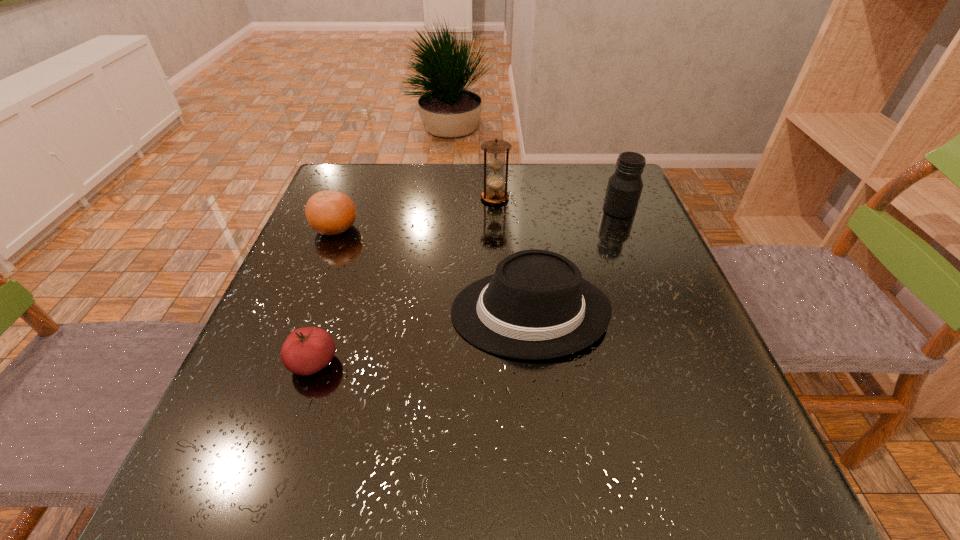
Locate an element on the screen. This screenshot has width=960, height=540. vacant region located 0.060m on the back of the clementine is located at coordinates (346, 202).

I want to click on free space located on the back of the tomato, so 334,301.

Identify the location of hourglass at the far edge. The width and height of the screenshot is (960, 540). (495, 181).

In order to click on jar that is positioned at the far edge in this screenshot , I will do `click(624, 188)`.

Where is `clementine that is at the left edge`? This screenshot has width=960, height=540. clementine that is at the left edge is located at coordinates (328, 212).

Locate an element on the screen. The height and width of the screenshot is (540, 960). tomato that is at the left edge is located at coordinates (307, 350).

Where is `object located at the right edge`? object located at the right edge is located at coordinates (624, 188).

What are the coordinates of `object located at the far right corner` in the screenshot? It's located at pos(624,188).

Identify the location of vacant area at the far edge of the desktop. (535, 193).

I want to click on vacant space at the near edge, so click(516, 464).